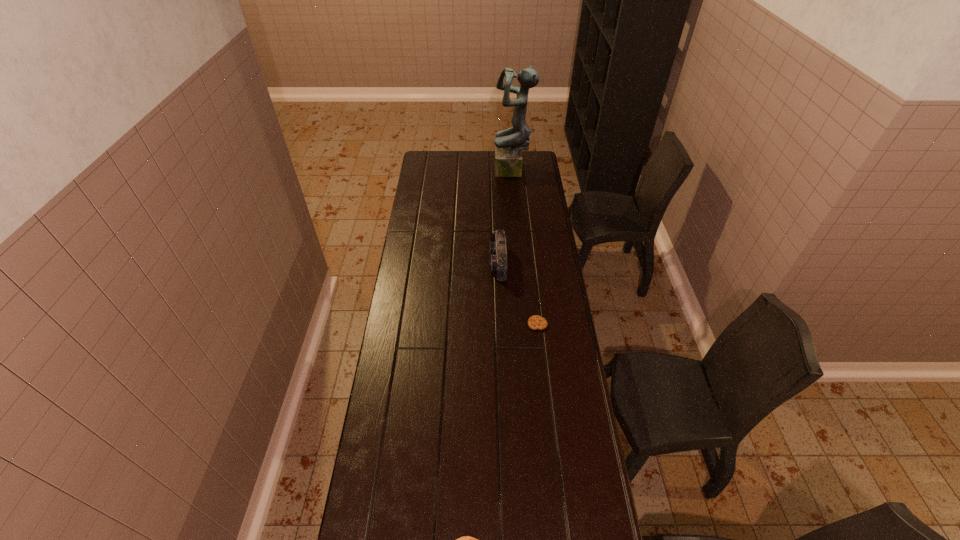
The width and height of the screenshot is (960, 540). In order to click on free space located 0.130m on the front-facing side of the camcorder in this screenshot , I will do `click(461, 263)`.

Identify the location of vacant space located on the front-facing side of the camcorder. (463, 263).

The image size is (960, 540). I want to click on vacant region located 0.140m on the back of the second nearest object, so click(534, 292).

In order to click on object located at the far edge in this screenshot , I will do `click(509, 143)`.

The image size is (960, 540). I want to click on sculpture located at the right edge, so click(x=509, y=143).

Where is `cookie that is positioned at the right edge`? cookie that is positioned at the right edge is located at coordinates (535, 322).

Find the location of a particular element. The width and height of the screenshot is (960, 540). object that is at the far right corner is located at coordinates (509, 143).

Find the location of `vacant space at the left edge of the desktop`. vacant space at the left edge of the desktop is located at coordinates (398, 311).

The height and width of the screenshot is (540, 960). In order to click on vacant region at the right edge of the desktop in this screenshot , I will do `click(594, 453)`.

Find the location of a particular element. This screenshot has width=960, height=540. free space at the far right corner of the desktop is located at coordinates (531, 162).